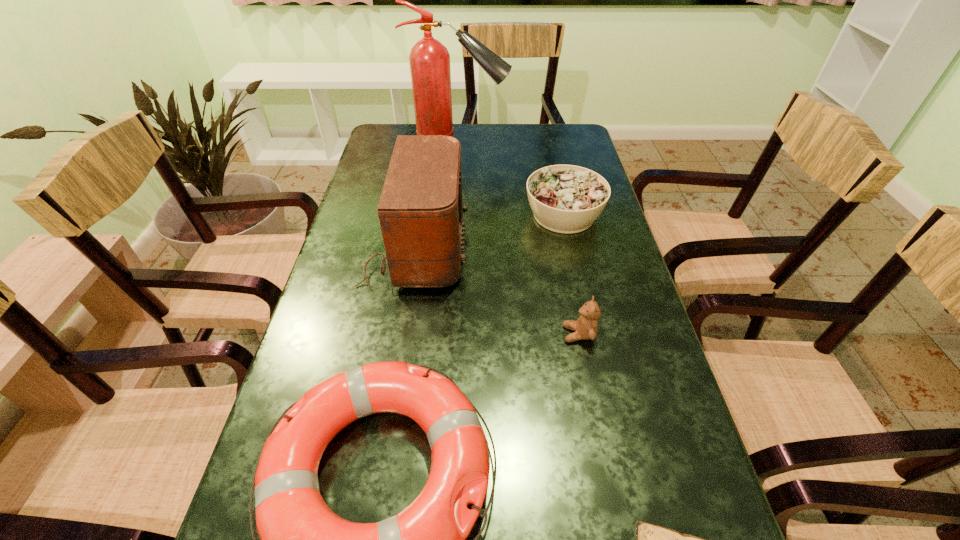
Find the location of a particular element. the farthest object is located at coordinates (429, 59).

At what (x,y) coordinates should I click in order to perform the action: click on the tallest object. Please return your answer as a coordinate pair (x, y). The width and height of the screenshot is (960, 540). Looking at the image, I should click on (429, 59).

The width and height of the screenshot is (960, 540). Identify the location of radio receiver. (420, 210).

What are the coordinates of `salad` in the screenshot? It's located at (567, 199).

Identify the location of teddy bear. The image size is (960, 540). (586, 327).

Locate an element on the screen. The image size is (960, 540). free space located at the nozzle end of the tallest object is located at coordinates (525, 143).

The image size is (960, 540). What are the coordinates of `free space located 0.300m on the front panel of the second tallest object` in the screenshot? It's located at (582, 249).

Find the location of a particular element. The width and height of the screenshot is (960, 540). free space located on the back of the salad is located at coordinates (550, 154).

Locate an element on the screen. vacant space located 0.240m on the face of the fourth farthest object is located at coordinates (453, 334).

The width and height of the screenshot is (960, 540). I want to click on vacant space located 0.380m on the face of the fourth farthest object, so click(389, 334).